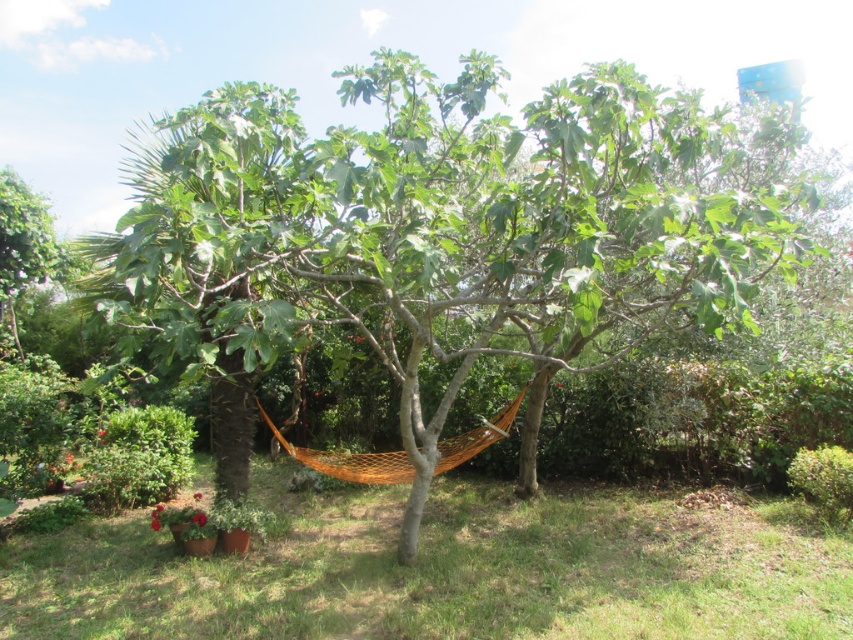
Is green leafy tree at center positioned in front of orange mesh hammock at center?

Yes.

From the picture: Does green leafy tree at center have a lesser width compared to orange mesh hammock at center?

No.

Where is `green leafy tree at center`? green leafy tree at center is located at coordinates (444, 230).